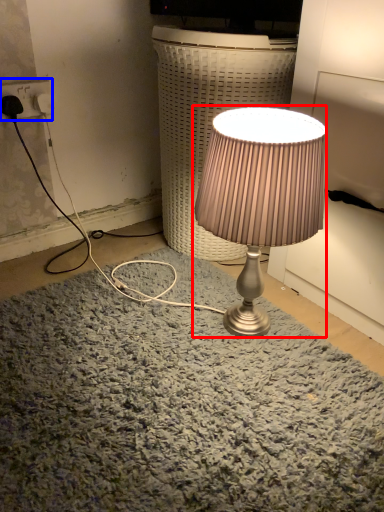
Question: Which point is further to the camera, lamp (highlighted by a red box) or electric outlet (highlighted by a blue box)?

Choices:
 (A) lamp
 (B) electric outlet

Answer: (B)